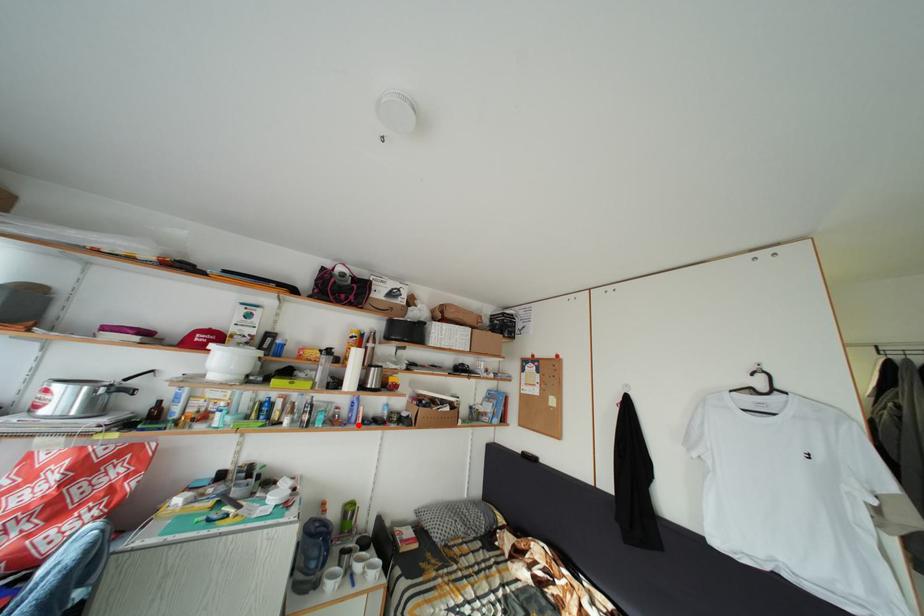
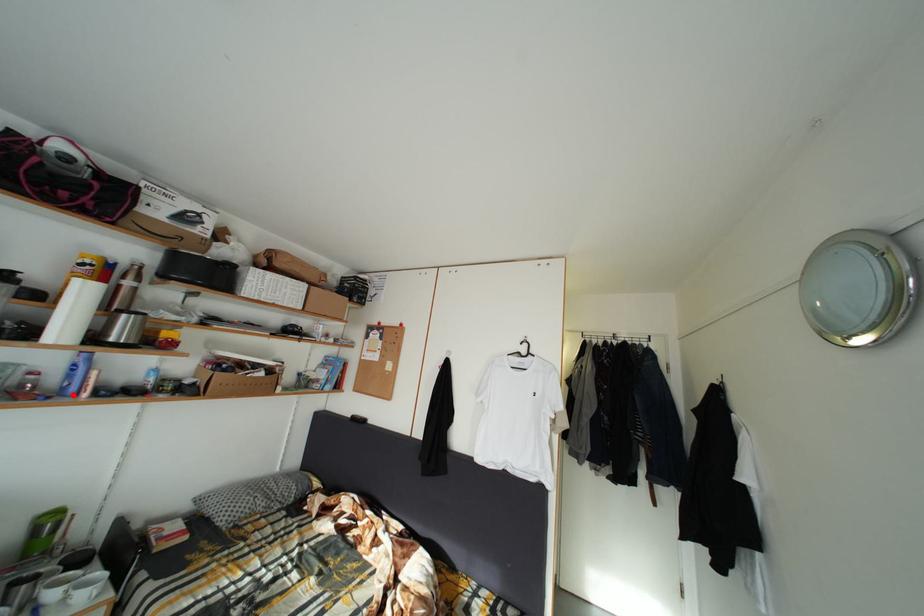
I am providing you with two images of the same scene from different viewpoints. A red point is marked on the first image and another point is marked on the second image. Are the points marked in image1 and image2 representing the same 3D position?

Yes